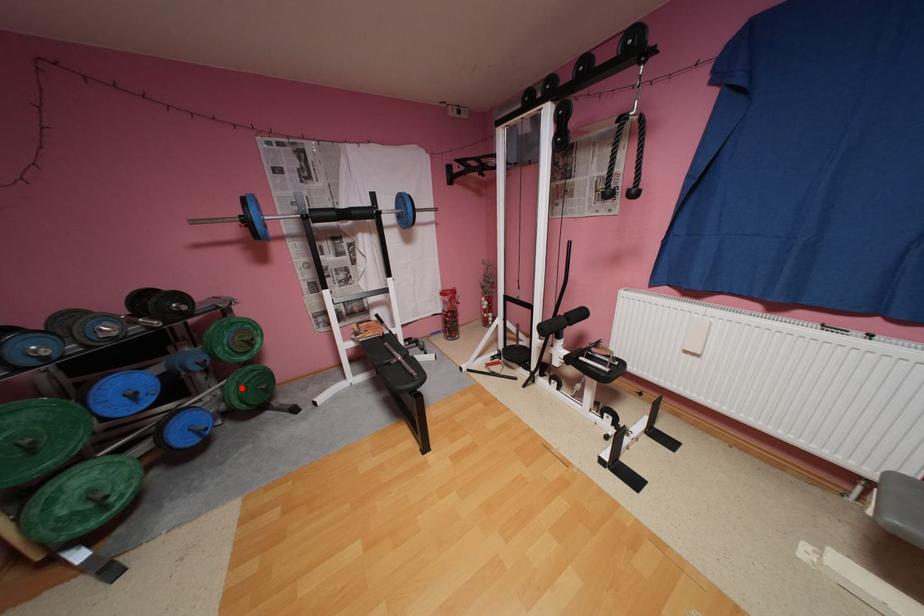
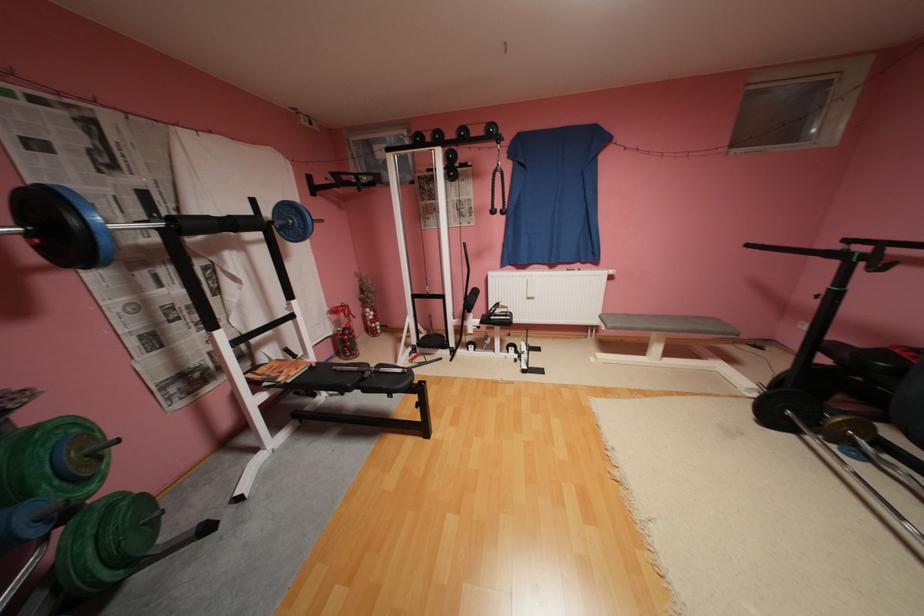
Find the pixel in the second image that matches the highlighted location in the first image.

(100, 551)